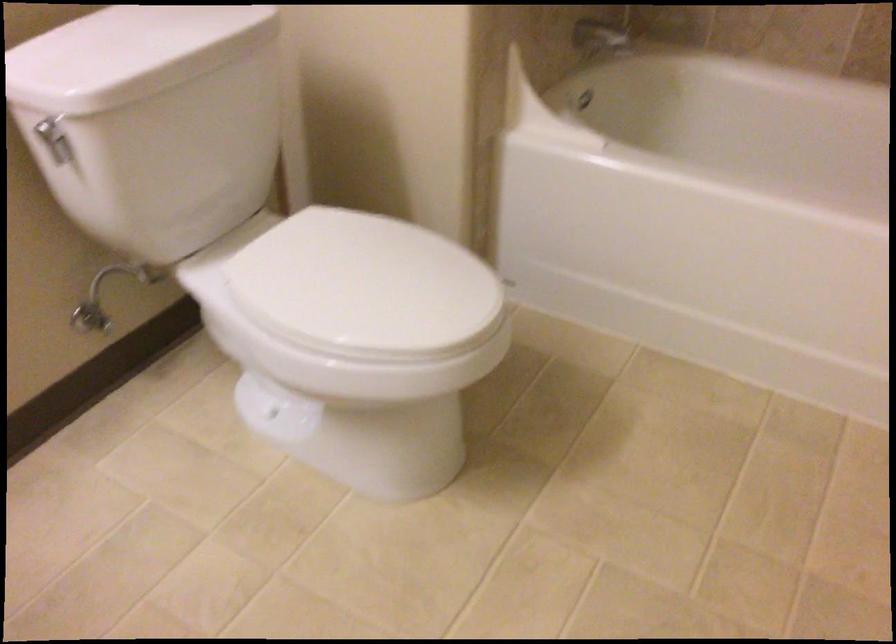
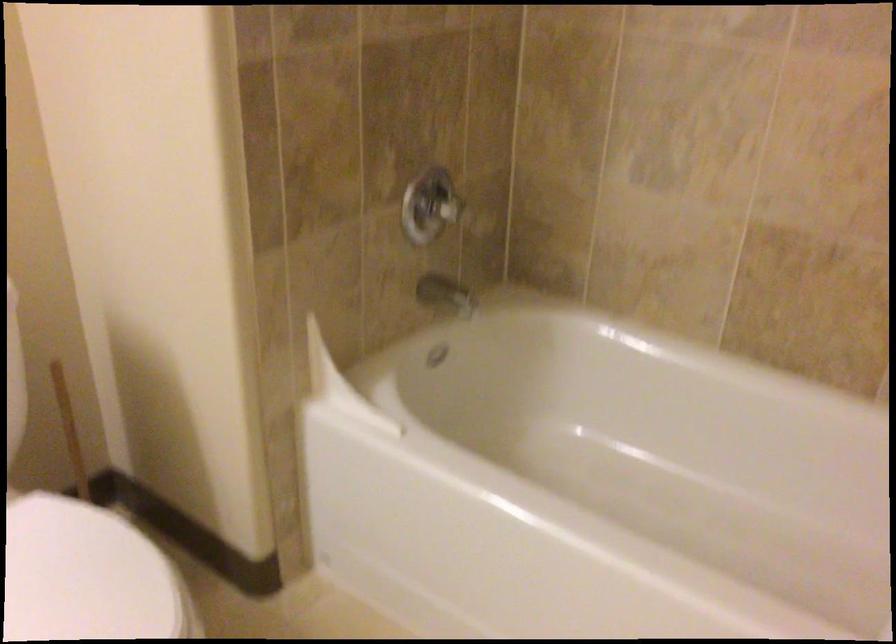
Question: I am providing you with two images of the same scene from different viewpoints. Please identify which objects are invisible in image2.

Choices:
 (A) chrome shower handle
 (B) chrome faucet spout
 (C) white toilet lid
 (D) none of these

Answer: (D)